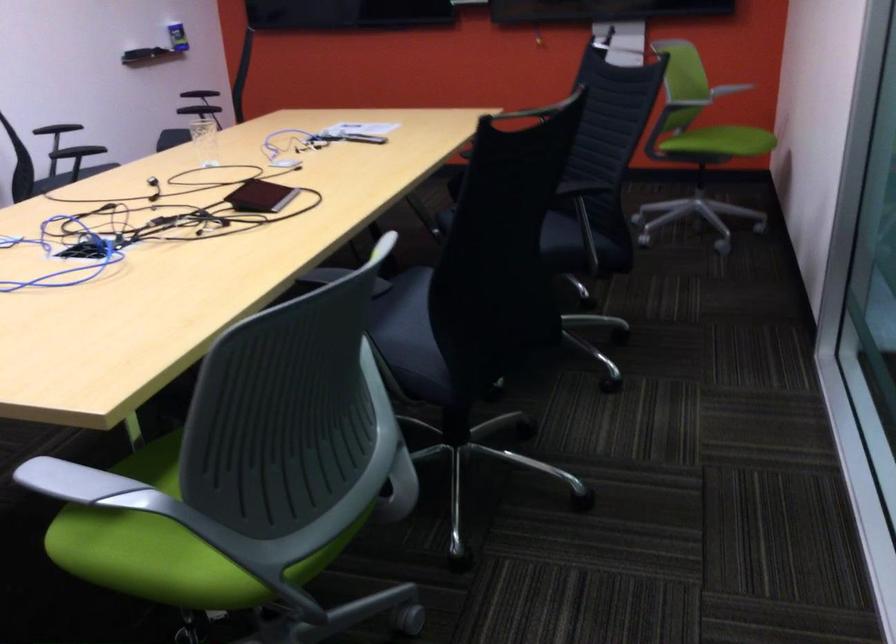
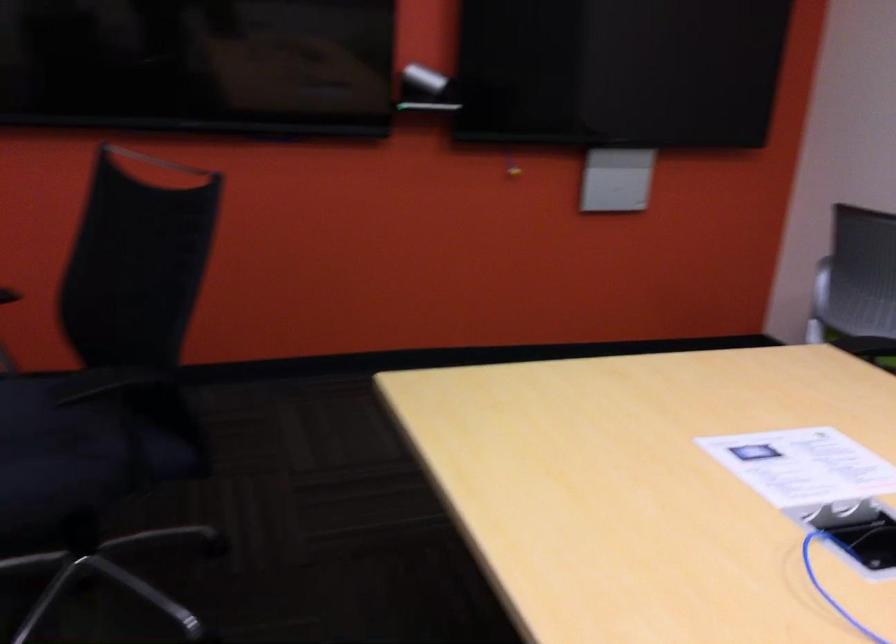
The point at (380,125) is marked in the first image. Where is the corresponding point in the second image?

(803, 466)